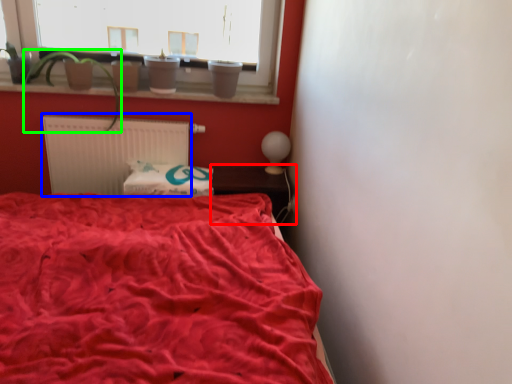
Question: Considering the real-world distances, which object is farthest from table (highlighted by a red box)? radiator (highlighted by a blue box) or plant (highlighted by a green box)?

Choices:
 (A) radiator
 (B) plant

Answer: (B)